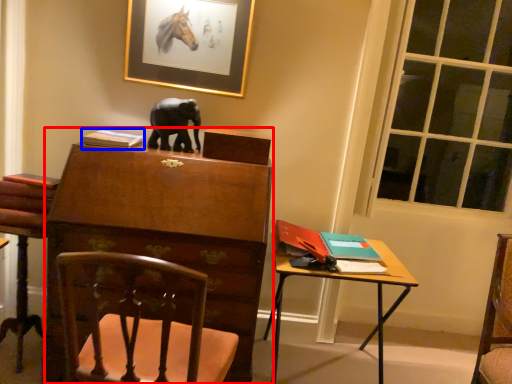
Question: Which object is closer to the camera taking this photo, chest of drawers (highlighted by a red box) or book (highlighted by a blue box)?

Choices:
 (A) chest of drawers
 (B) book

Answer: (A)